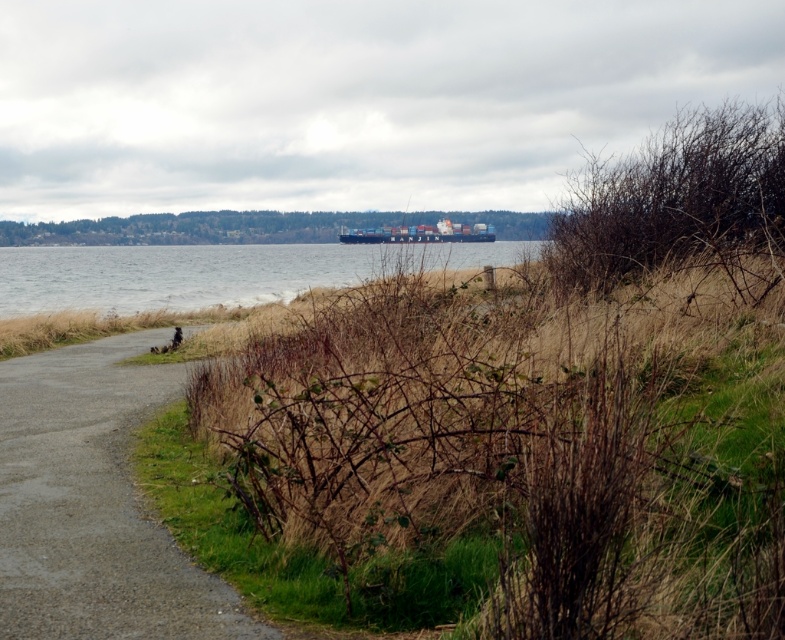
Question: Which point is closer to the camera?

Choices:
 (A) (134, 294)
 (B) (459, 234)

Answer: (A)

Question: Does gray asphalt path at lower left appear under blue metallic water at center?

Choices:
 (A) yes
 (B) no

Answer: (A)

Question: Among these objects, which one is nearest to the camera?

Choices:
 (A) gray asphalt path at lower left
 (B) blue metallic water at center
 (C) blue matte container ship at center

Answer: (A)

Question: Does gray asphalt path at lower left have a larger size compared to blue metallic water at center?

Choices:
 (A) yes
 (B) no

Answer: (B)

Question: From the image, what is the correct spatial relationship of blue metallic water at center in relation to blue matte container ship at center?

Choices:
 (A) left
 (B) right

Answer: (A)

Question: Considering the real-world distances, which object is closest to the gray asphalt path at lower left?

Choices:
 (A) blue matte container ship at center
 (B) blue metallic water at center

Answer: (B)